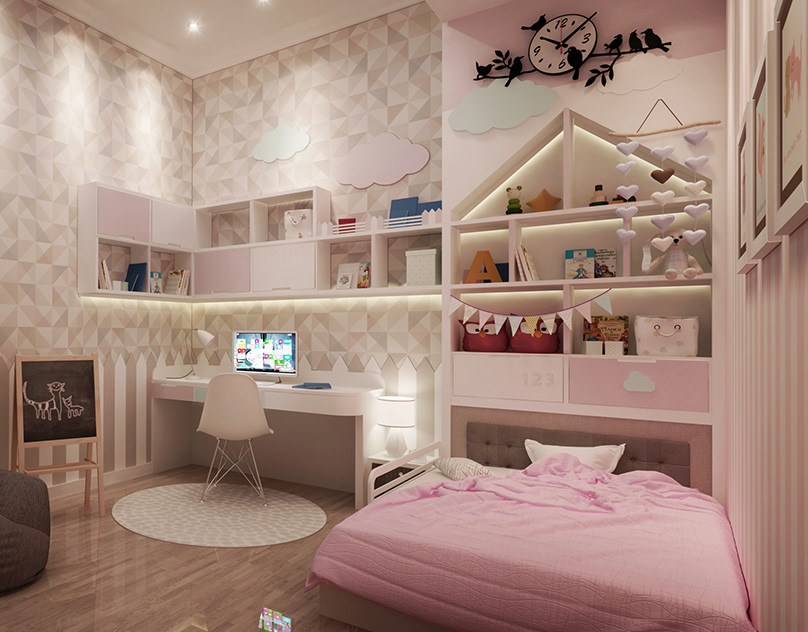
I want to click on white desk chair, so click(229, 425).